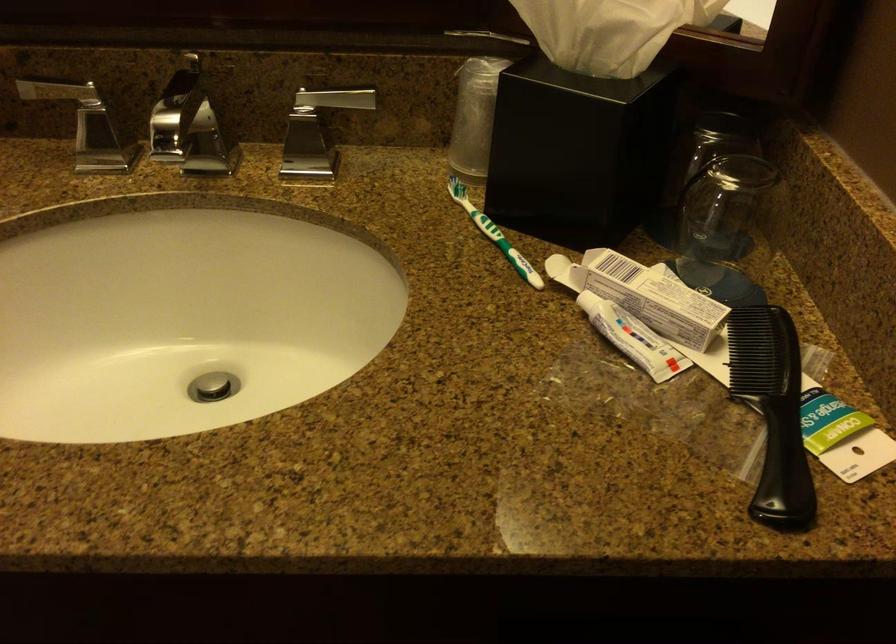
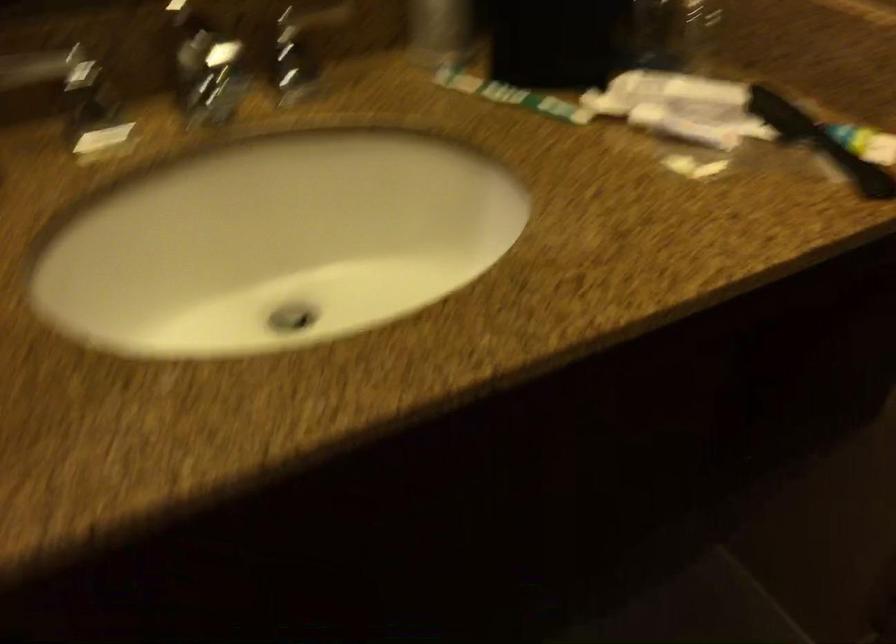
Question: What movement of the cameraman would produce the second image?

Choices:
 (A) Left
 (B) Right
 (C) Forward
 (D) Backward

Answer: (A)